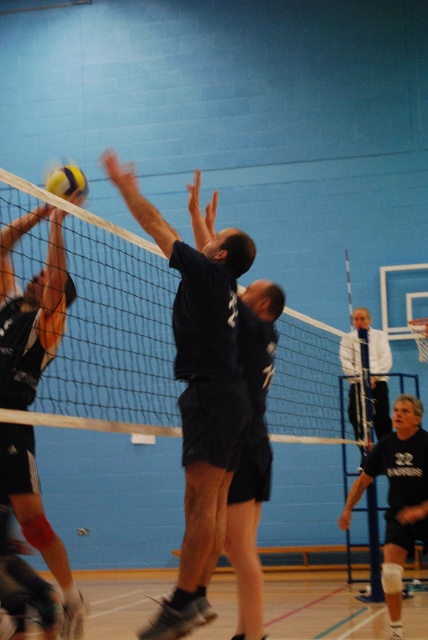
You are a volleyball player preparing to serve the ball from the baseline. The rules state that you must be at least 2 meters away from the white mesh net at center to serve legally. Can you serve the ball from your current position?

The white mesh net at center is 3.53 meters away from you, so yes, you can serve the ball from your current position because you are more than 2 meters away from the white mesh net at center.

You are a photographer at the volleyball game. You want to take a photo of the dark blue jersey at center and the white fabric shirt at upper center. Which one should you focus on first if you want to capture both in the same frame without moving the camera?

The dark blue jersey at center has a greater height compared to the white fabric shirt at upper center, so you should focus on the dark blue jersey at center first as it is taller and will require adjusting the focus to include the shorter white fabric shirt at upper center in the frame.